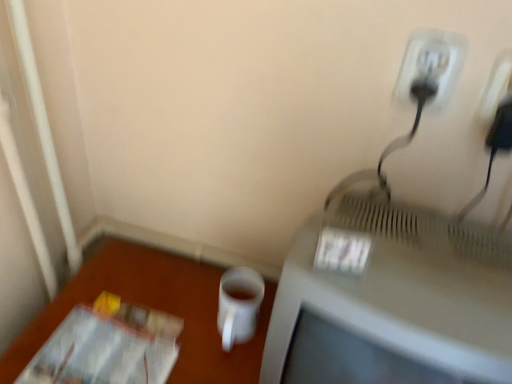
Find the location of a particular element. free space in front of white matte mug at lower center is located at coordinates (219, 359).